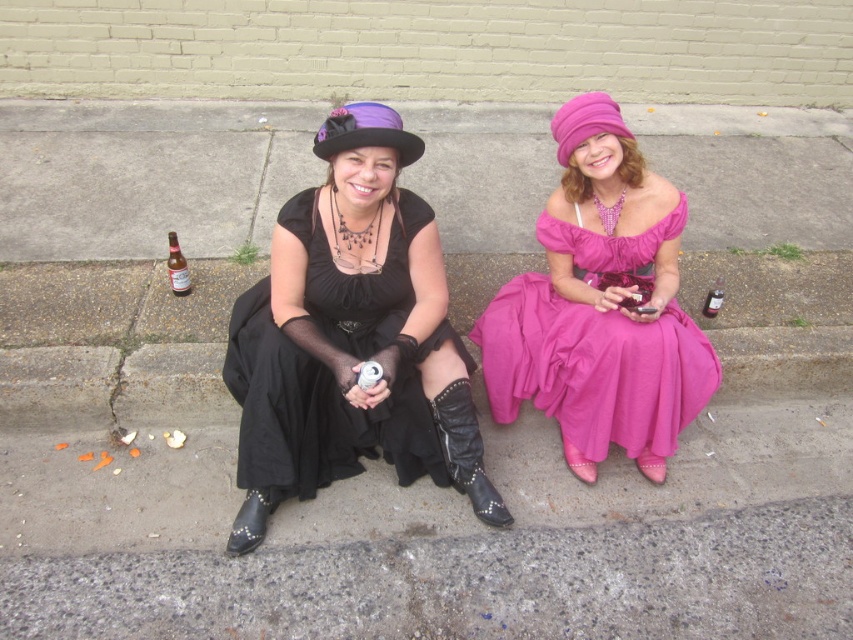
You are standing in front of the image and want to locate the black satin dress at center. What are the coordinates of its position?

The coordinates of the black satin dress at center are at point (322,410).

You are a photographer trying to capture a detailed shot of both the studded leather boot at lower center and the clear glass bottle at right. Since you want to focus on their widths, which object should you zoom in on first to ensure it fits within your camera frame?

The studded leather boot at lower center is wider than the clear glass bottle at right, so you should zoom in on the studded leather boot at lower center first to ensure it fits within your camera frame before adjusting for the narrower bottle.

You are an interior designer planning to place a new sofa in a room. The sofa must be positioned so that it faces away from the matte pink satin dress at center. Based on the scene description, where should you place the sofa?

The sofa should be placed facing away from the matte pink satin dress at center, which is located at point (595, 368). This means positioning the sofa in a direction opposite to that coordinate to ensure it doesn not face the dress.